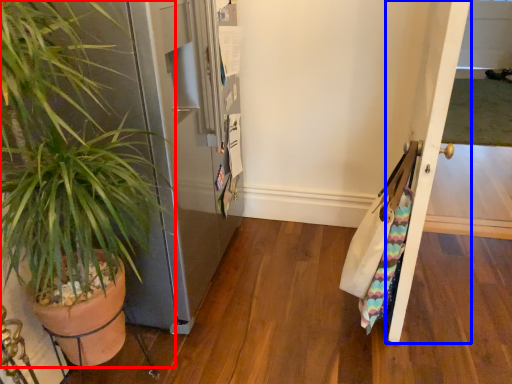
Question: Which of the following is the farthest to the observer, houseplant (highlighted by a red box) or door (highlighted by a blue box)?

Choices:
 (A) houseplant
 (B) door

Answer: (B)